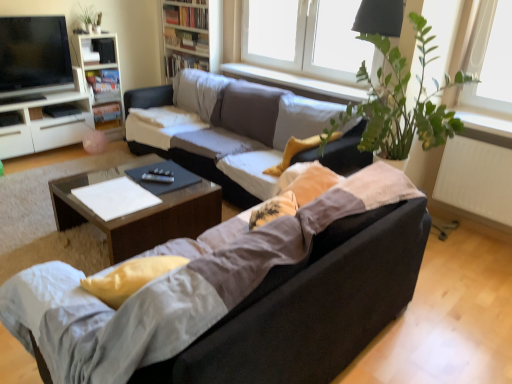
Question: Do you think wooden bookshelf at upper center, which is counted as the 2th bookshelf, starting from the left, is within white glossy cabinet at left, or outside of it?

Choices:
 (A) outside
 (B) inside

Answer: (A)

Question: From a real-world perspective, relative to white glossy cabinet at left, is wooden bookshelf at upper center, which is counted as the 2th bookshelf, starting from the left, vertically above or below?

Choices:
 (A) above
 (B) below

Answer: (A)

Question: Which object is positioned farthest from the white glossy bookshelf at upper left, the second bookshelf positioned from the right?

Choices:
 (A) matte gray couch at center, which is the 1th studio couch in back-to-front order
 (B) matte black coffee table at center
 (C) white plastic window at upper center
 (D) white glossy cabinet at left
 (E) white smooth window sill at upper center

Answer: (B)

Question: Considering the real-world distances, which object is farthest from the white matte radiator at right?

Choices:
 (A) wooden bookshelf at upper center, which is the first bookshelf from right to left
 (B) matte black tv at upper left
 (C) white glossy bookshelf at upper left, the first bookshelf when ordered from left to right
 (D) white plastic window at upper center
 (E) matte black couch at center, acting as the first studio couch starting from the front

Answer: (B)